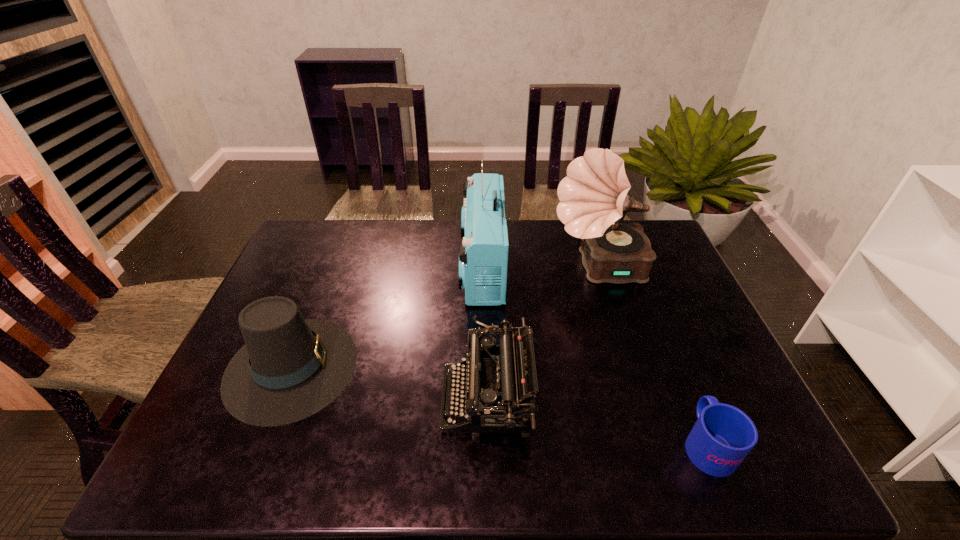
The height and width of the screenshot is (540, 960). In order to click on the tallest object in this screenshot , I will do `click(593, 196)`.

Image resolution: width=960 pixels, height=540 pixels. Find the location of `radio receiver`. radio receiver is located at coordinates (483, 256).

Identify the location of the leftmost object. (290, 368).

You are a GUI agent. You are given a task and a screenshot of the screen. Output one action in this format:
    pyautogui.click(x=<x>, y=<y>)
    Task: Click on the typewriter
    The image size is (960, 540).
    Given the screenshot: What is the action you would take?
    tap(494, 374)

Identify the location of the shortest object. The image size is (960, 540). [723, 435].

Find the location of a particular element. Image resolution: width=960 pixels, height=540 pixels. free spot located 0.110m from the horn of the tallest object is located at coordinates pos(516,268).

Find the location of a particular element. Image resolution: width=960 pixels, height=540 pixels. free spot located 0.390m from the horn of the tallest object is located at coordinates (429, 268).

Identify the location of free spot located 0.160m from the horn of the tallest object. The image size is (960, 540). (500, 268).

You are a GUI agent. You are given a task and a screenshot of the screen. Output one action in this format:
    pyautogui.click(x=<x>, y=<y>)
    Task: Click on the vacant space located on the front-facing side of the radio receiver
    
    Given the screenshot: What is the action you would take?
    pyautogui.click(x=445, y=267)

Identify the location of free space located 0.400m on the front-facing side of the radio receiver. (337, 267).